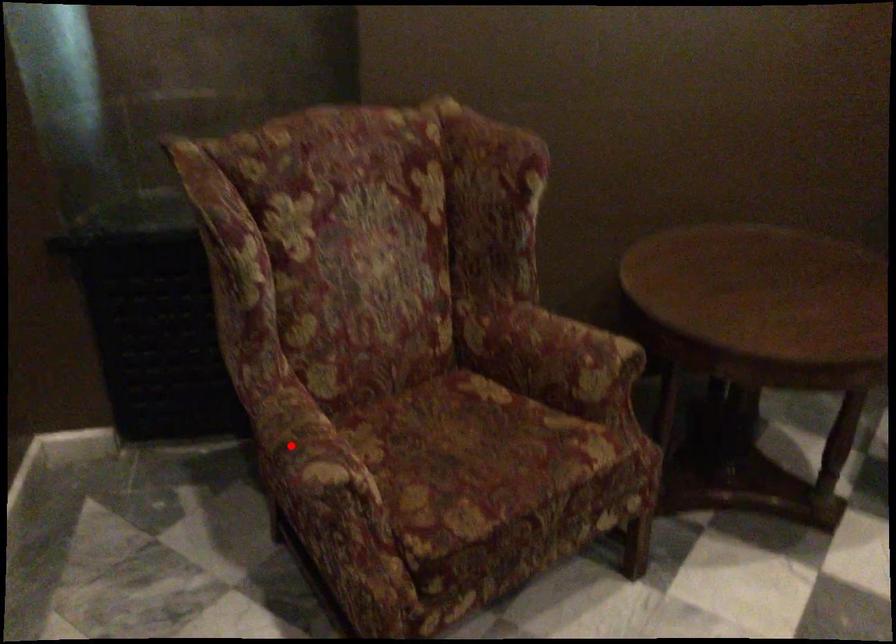
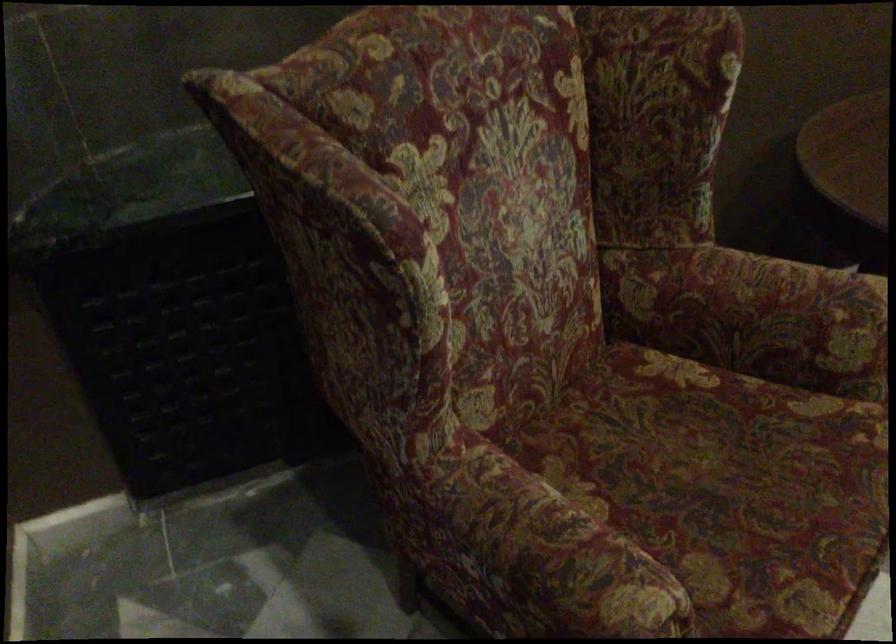
Question: I am providing you with two images of the same scene from different viewpoints. A red point is shown in image1. For the corresponding object point in image2, is it positioned nearer or farther from the camera?

Choices:
 (A) Nearer
 (B) Farther

Answer: (A)